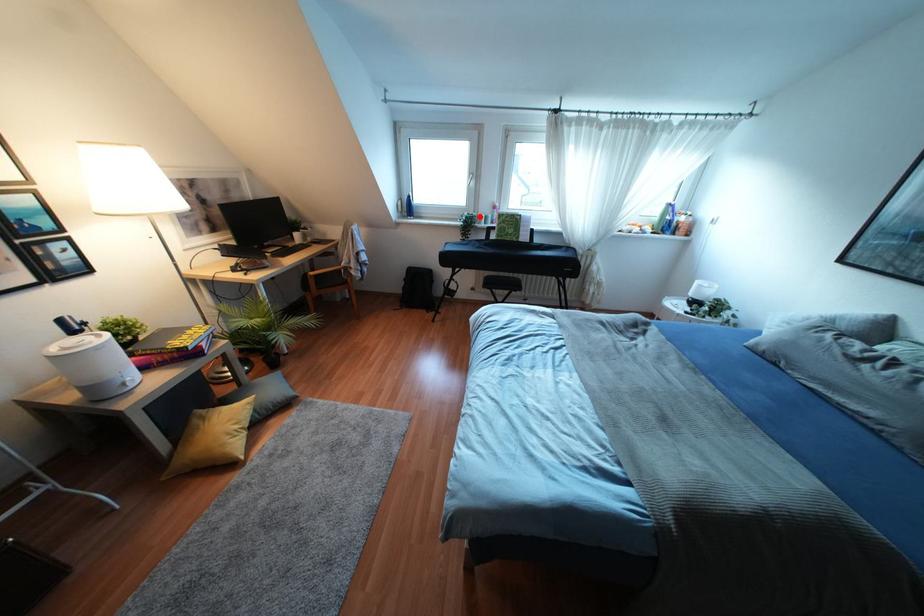
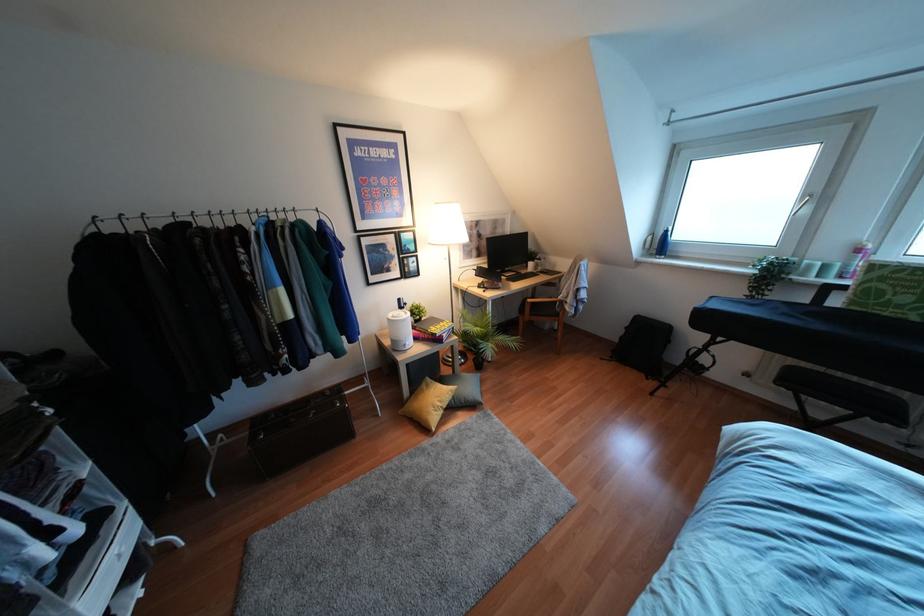
The point at the highlighted location is marked in the first image. Where is the corresponding point in the second image?

(809, 265)